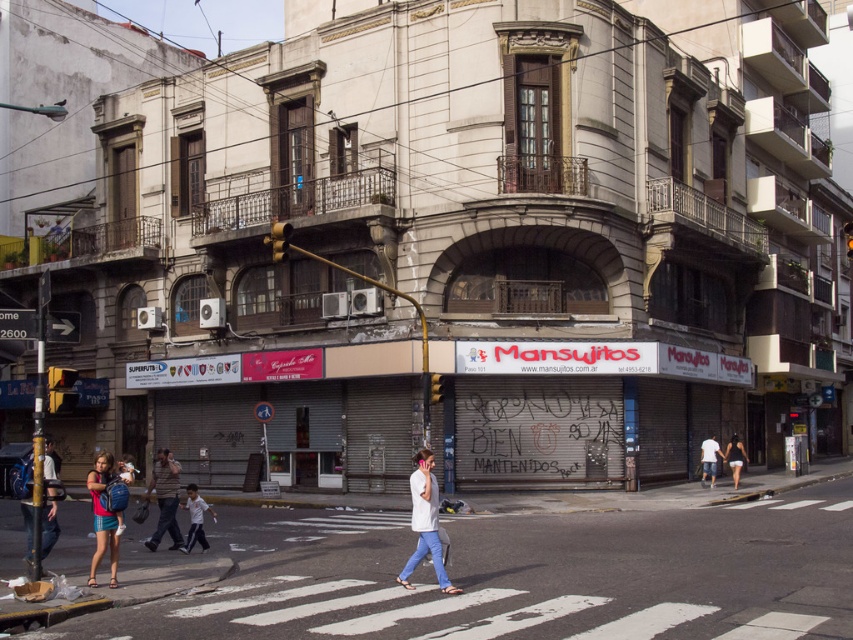
Question: Which of the following is the closest to the observer?

Choices:
 (A) white matte shirt at center
 (B) light blue jeans at center
 (C) dark blue jeans at lower right
 (D) matte blue backpack at center

Answer: (A)

Question: Considering the real-world distances, which object is closest to the brown leather jacket at center?

Choices:
 (A) white matte shirt at center
 (B) denim shorts at lower left
 (C) matte blue backpack at center
 (D) light blue jeans at center

Answer: (D)

Question: Is white pedestrian crossing at center wider than light blue jeans at center?

Choices:
 (A) no
 (B) yes

Answer: (B)

Question: Is matte blue backpack at center positioned at the back of denim shorts at lower left?

Choices:
 (A) yes
 (B) no

Answer: (A)

Question: Which is nearer to the white pedestrian crossing at center?

Choices:
 (A) light blue jeans at center
 (B) white matte shirt at center
 (C) matte blue backpack at center
 (D) white cotton shirt at center-right

Answer: (B)

Question: Is white matte shirt at center to the left of white cotton shirt at center-right from the viewer's perspective?

Choices:
 (A) no
 (B) yes

Answer: (B)